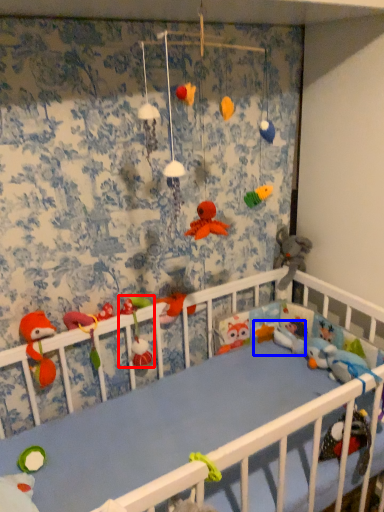
Question: Which object is closer to the camera taking this photo, toy (highlighted by a red box) or toy (highlighted by a blue box)?

Choices:
 (A) toy
 (B) toy

Answer: (A)